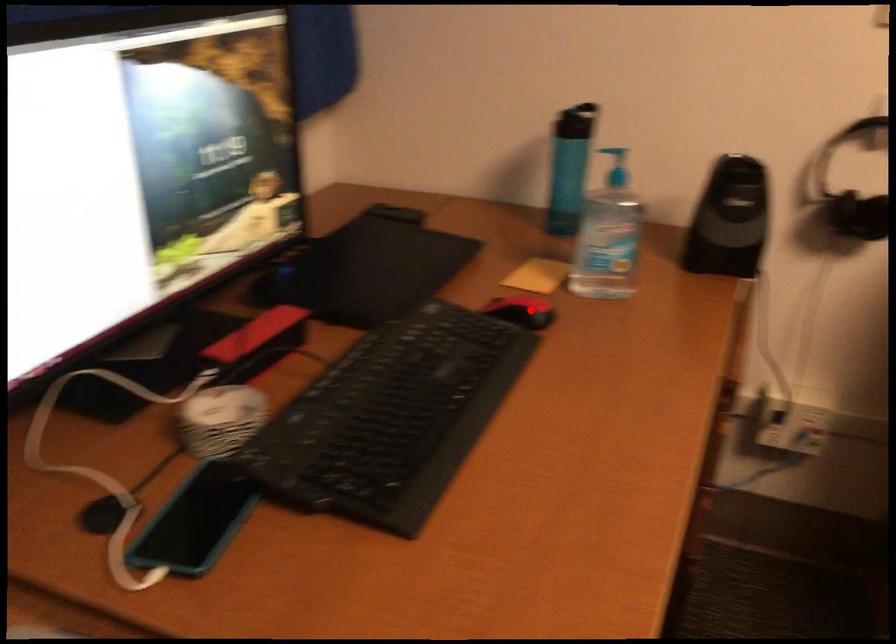
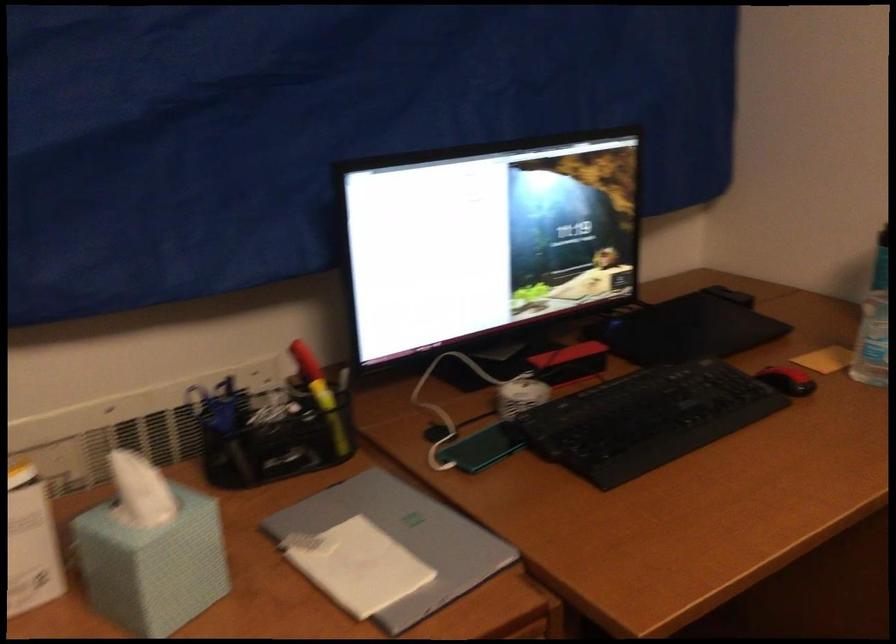
The point at the highlighted location is marked in the first image. Where is the corresponding point in the second image?

(787, 380)